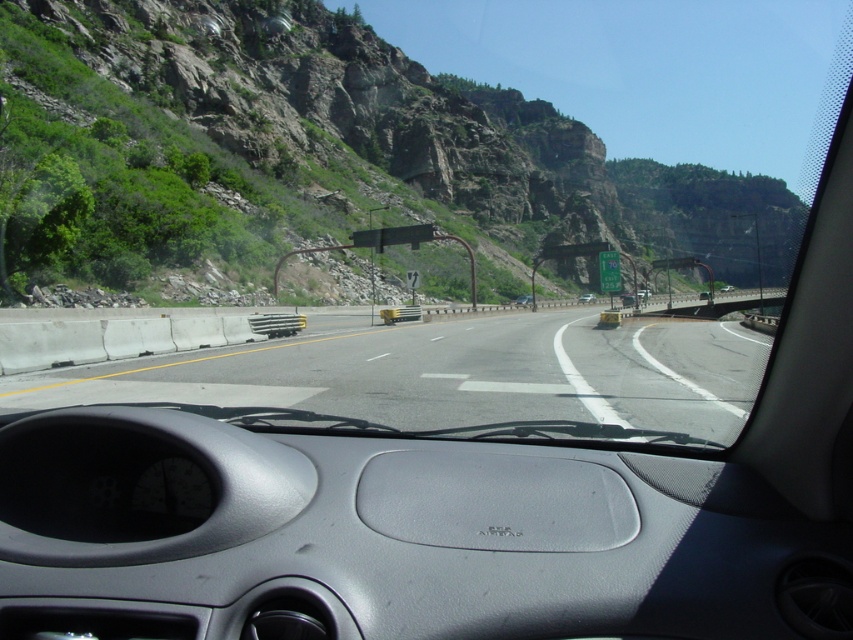
Which of these two, gray matte dashboard at center or asphalt road at center, stands taller?

With more height is asphalt road at center.

Can you confirm if gray matte dashboard at center is positioned below asphalt road at center?

Yes, gray matte dashboard at center is below asphalt road at center.

Identify the location of gray matte dashboard at center. The height and width of the screenshot is (640, 853). (413, 531).

Which is more to the left, green rocky hillside at upper left or silver metallic sedan at center?

From the viewer's perspective, green rocky hillside at upper left appears more on the left side.

Is green rocky hillside at upper left taller than silver metallic sedan at center?

Yes, green rocky hillside at upper left is taller than silver metallic sedan at center.

This screenshot has height=640, width=853. What are the coordinates of `green rocky hillside at upper left` in the screenshot? It's located at (398, 125).

In order to click on green rocky hillside at upper left in this screenshot , I will do `click(398, 125)`.

Looking at this image, is gray matte dashboard at center bigger than metallic silver sedan at center?

No.

Between gray matte dashboard at center and metallic silver sedan at center, which one has less height?

With less height is gray matte dashboard at center.

Which is behind, point (675, 570) or point (527, 301)?

Point (527, 301)

Image resolution: width=853 pixels, height=640 pixels. I want to click on gray matte dashboard at center, so click(x=413, y=531).